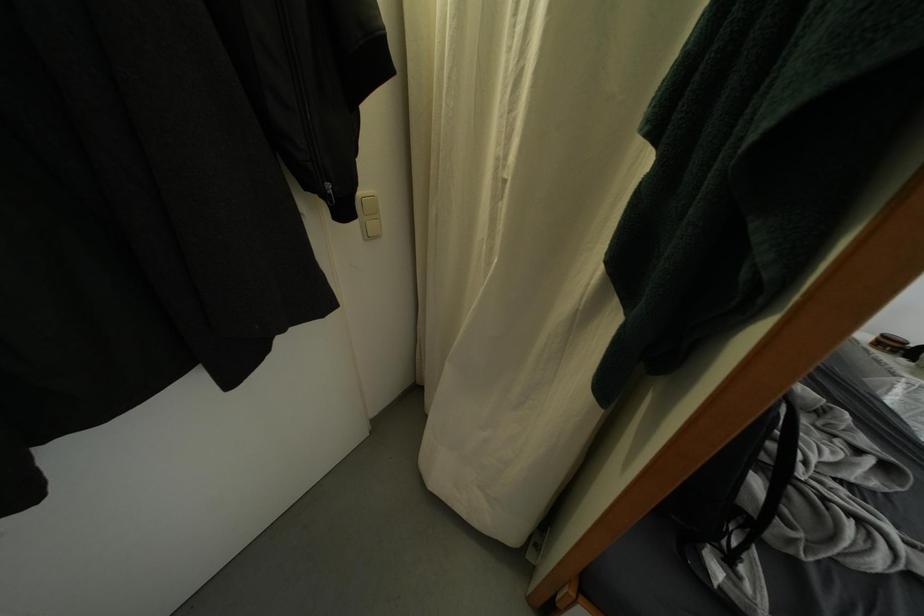
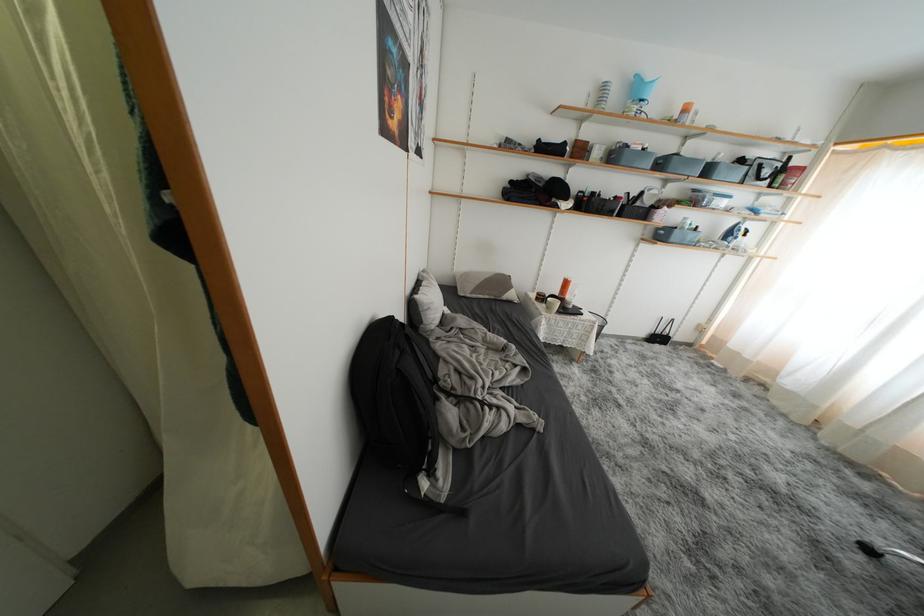
Question: The camera is either moving clockwise (left) or counter-clockwise (right) around the object. The first image is from the beginning of the video and the second image is from the end. Is the camera moving left or right when shooting the video?

Choices:
 (A) Left
 (B) Right

Answer: (A)